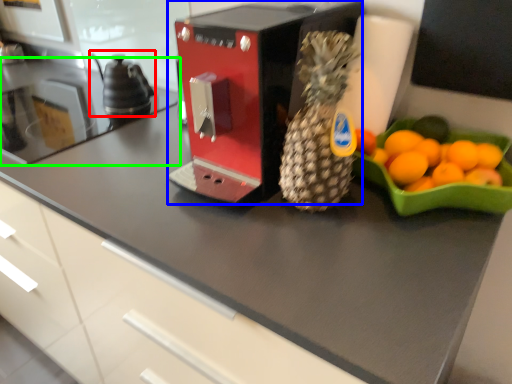
Question: Based on their relative distances, which object is farther from tea pot (highlighted by a red box)? Choose from kitchen appliance (highlighted by a blue box) and countertop (highlighted by a green box).

Choices:
 (A) kitchen appliance
 (B) countertop

Answer: (A)